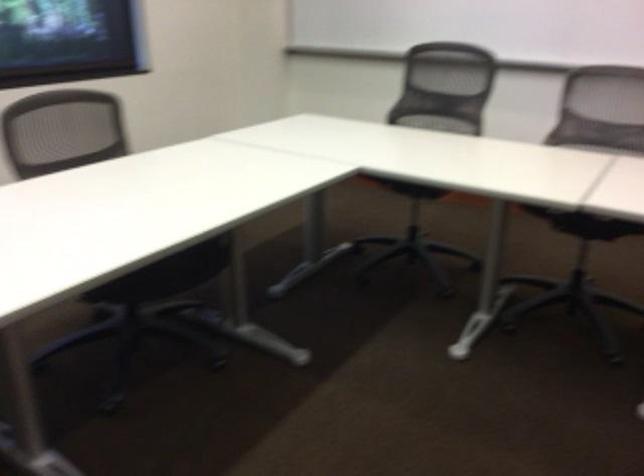
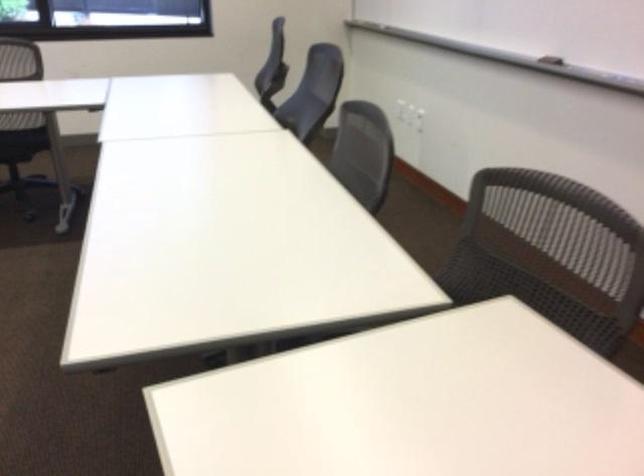
Question: I am providing you with two images of the same scene from different viewpoints. Please identify which objects are invisible in image2.

Choices:
 (A) blue deodorant cap
 (B) whiteboard eraser
 (C) chair sitting surface
 (D) black chair sitting surface

Answer: (C)